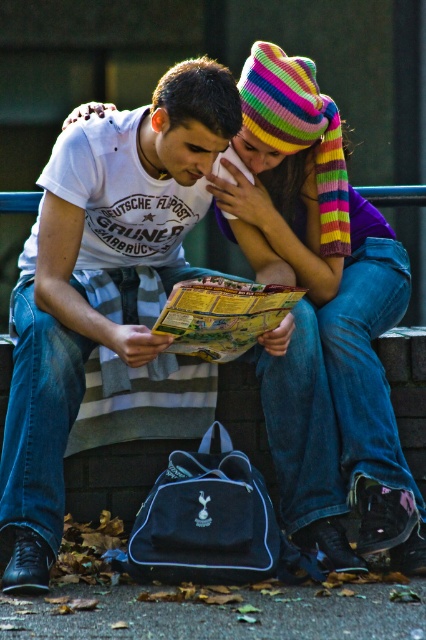
Question: Can you confirm if knitted woolen hat at upper center is positioned to the left of yellow paper map at center?

Choices:
 (A) no
 (B) yes

Answer: (A)

Question: Is knitted woolen hat at upper center smaller than yellow paper map at center?

Choices:
 (A) yes
 (B) no

Answer: (B)

Question: Which point appears closest to the camera in this image?

Choices:
 (A) (259, 332)
 (B) (316, 211)

Answer: (A)

Question: Does knitted woolen hat at upper center appear over yellow paper map at center?

Choices:
 (A) yes
 (B) no

Answer: (A)